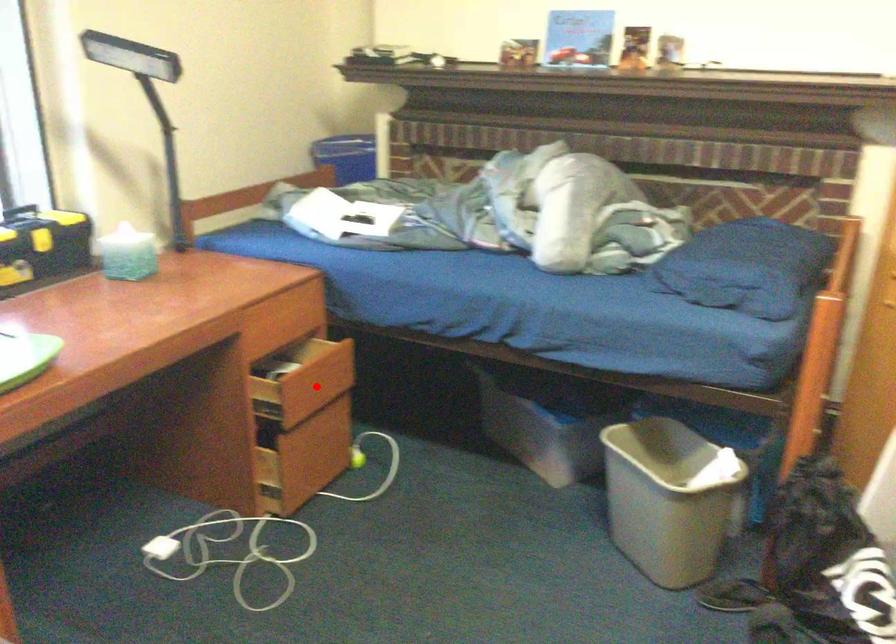
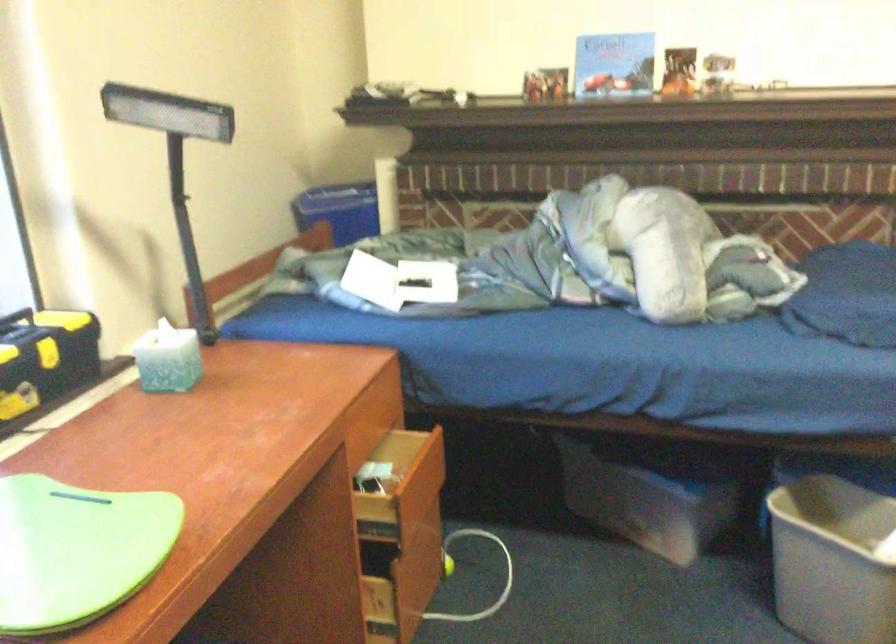
Find the pixel in the second image that matches the highlighted location in the first image.

(419, 489)